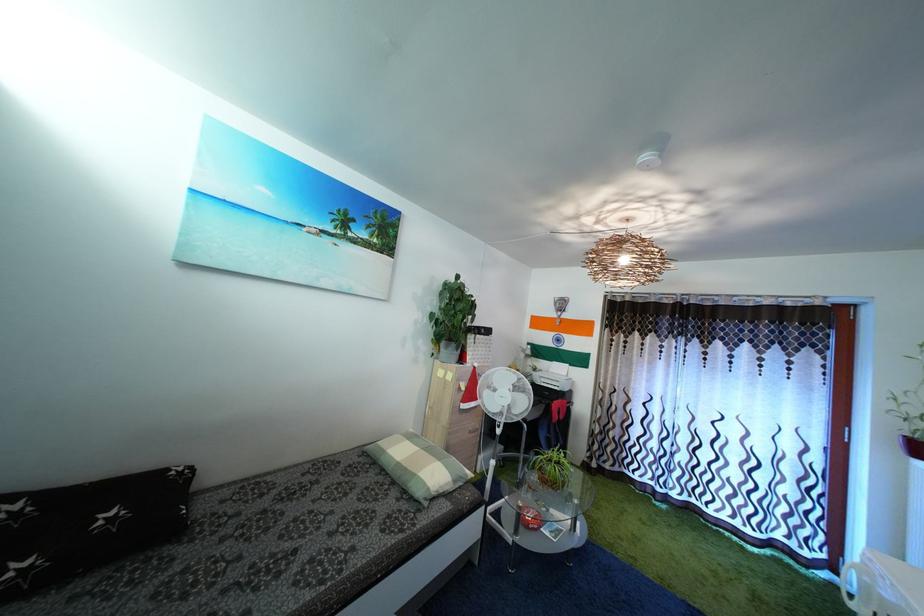
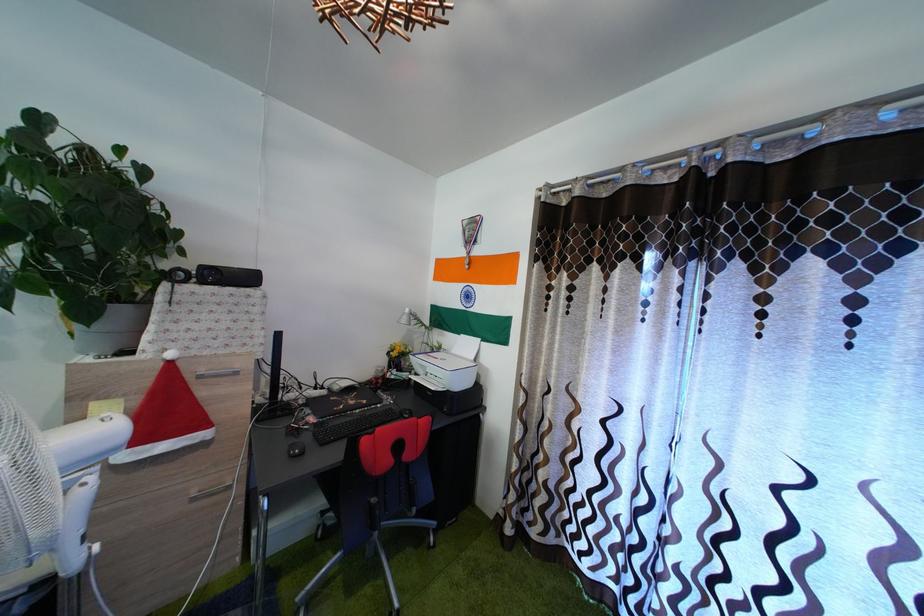
Where in the second image is the point corresponding to point (495, 339) from the first image?

(257, 286)